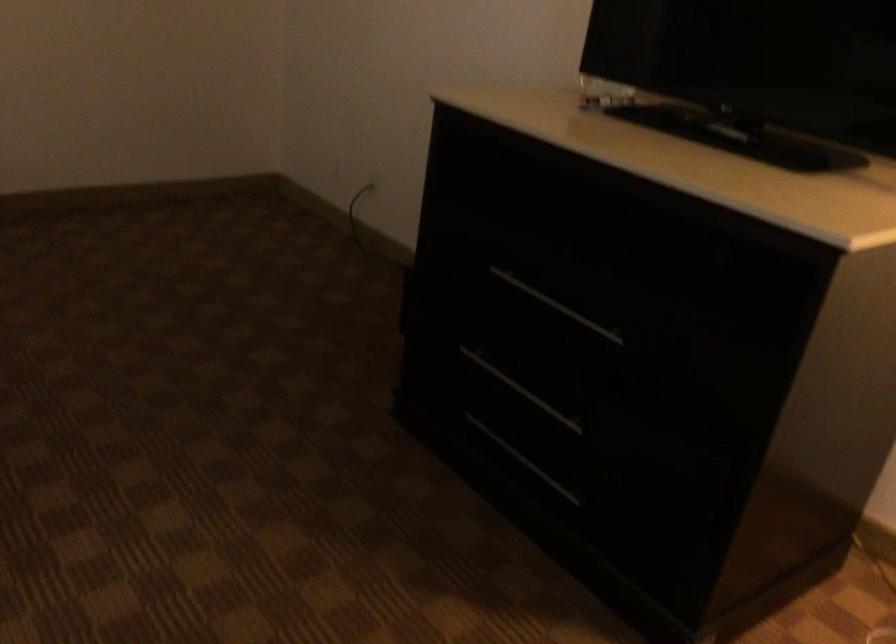
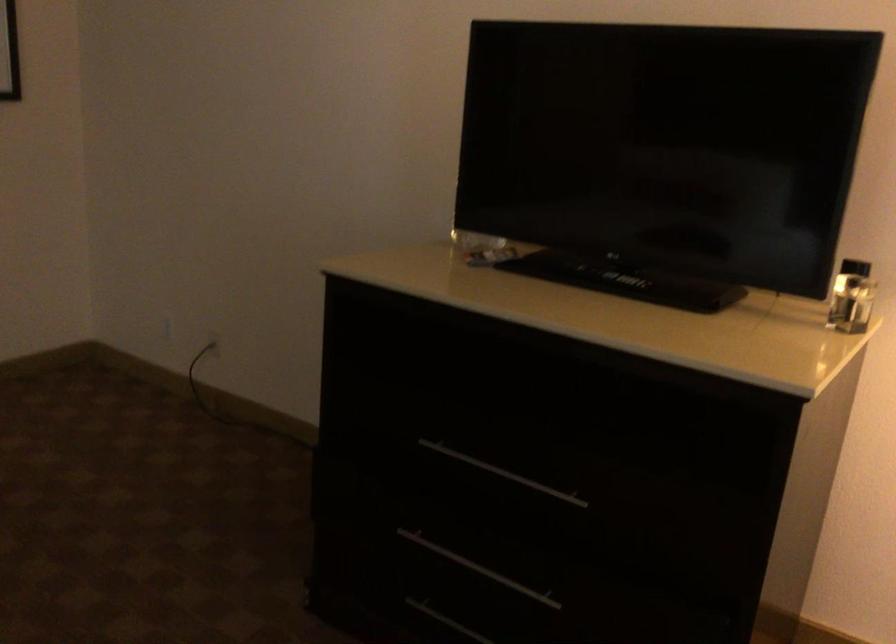
In the second image, find the point that corresponds to (556,303) in the first image.

(502, 473)